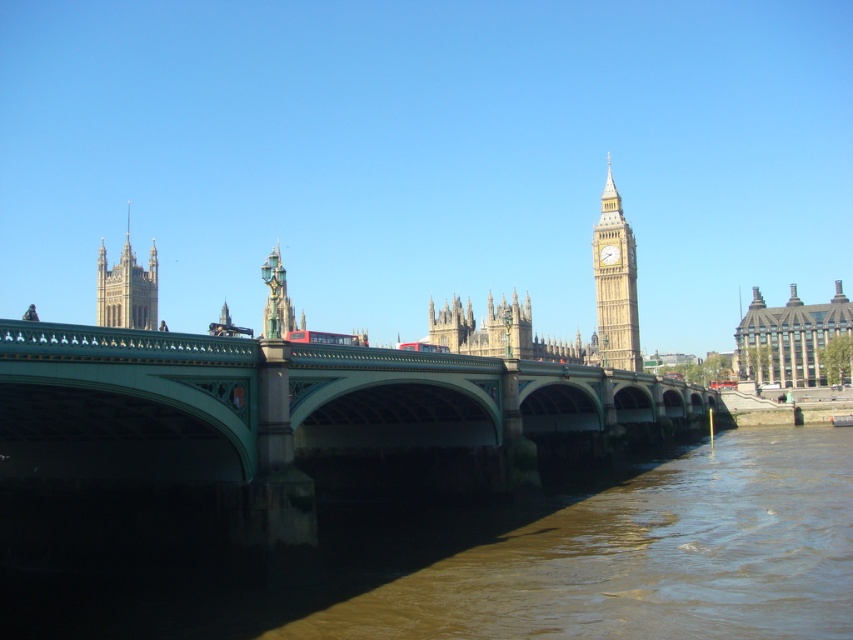
Question: Which of the following is the closest to the observer?

Choices:
 (A) (329, 333)
 (B) (805, 321)
 (C) (154, 259)
 (D) (115, 404)

Answer: (D)

Question: Can you confirm if green stone bridge at center is positioned above gray stone building at right?

Choices:
 (A) yes
 (B) no

Answer: (B)

Question: Which is nearer to the golden stone clock tower at upper right?

Choices:
 (A) brown sedimentary water at lower left
 (B) golden stone tower at upper center
 (C) red metallic bus at center

Answer: (A)

Question: Which point is closer to the camera taking this photo?

Choices:
 (A) (136, 284)
 (B) (466, 360)
 (C) (630, 260)

Answer: (B)

Question: Does brown sedimentary water at lower left appear under golden stone clock tower at upper right?

Choices:
 (A) no
 (B) yes

Answer: (B)

Question: Is gray stone building at right to the left of golden stone tower at upper center from the viewer's perspective?

Choices:
 (A) yes
 (B) no

Answer: (B)